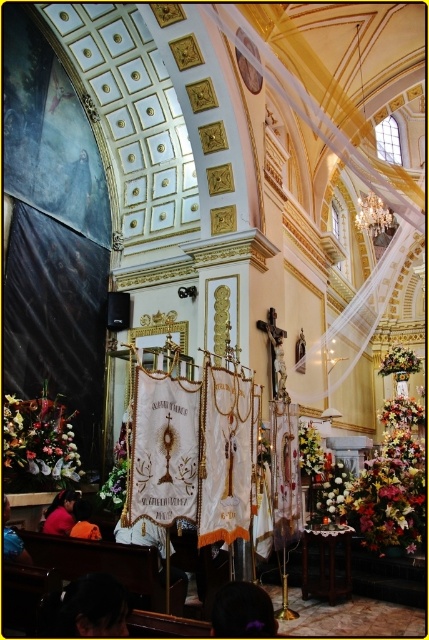
Which is in front, point (51, 467) or point (405, 362)?

Point (51, 467)

Does point (54, 435) come farther from viewer compared to point (404, 372)?

No, (54, 435) is closer to viewer.

Measure the distance between floral bouquet at lower left and camera.

floral bouquet at lower left and camera are 38.15 meters apart from each other.

Where is `floral bouquet at lower left`? The width and height of the screenshot is (429, 640). floral bouquet at lower left is located at coordinates (41, 438).

Who is positioned more to the right, green leafy plant at center or floral bouquet at center?

Positioned to the right is floral bouquet at center.

Which is in front, point (302, 456) or point (398, 364)?

Point (302, 456) is in front.

Locate an element on the screen. This screenshot has height=640, width=429. green leafy plant at center is located at coordinates [x=310, y=449].

From the picture: Can you confirm if floral bouquet at lower left is positioned below green leafy plant at center?

No, floral bouquet at lower left is not below green leafy plant at center.

Can you confirm if floral bouquet at lower left is taller than green leafy plant at center?

Yes.

Between point (24, 440) and point (310, 442), which one is positioned in front?

Point (24, 440) is in front.

Where is `floral bouquet at lower left`? The height and width of the screenshot is (640, 429). floral bouquet at lower left is located at coordinates click(41, 438).